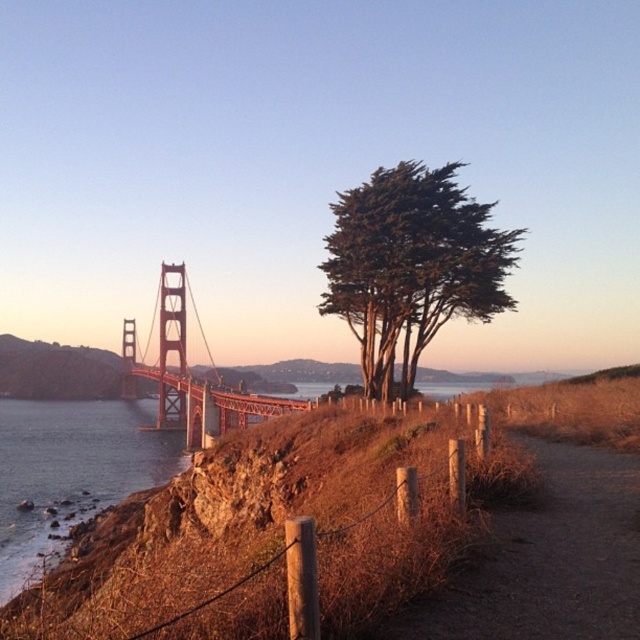
Question: Estimate the real-world distances between objects in this image. Which object is farther from the green textured tree at center?

Choices:
 (A) brown dirt path at center
 (B) red-orange metallic bridge at left

Answer: (A)

Question: Is green textured tree at center thinner than clear water at lower left?

Choices:
 (A) no
 (B) yes

Answer: (B)

Question: Which of the following is the closest to the observer?

Choices:
 (A) green textured tree at center
 (B) red-orange metallic bridge at left
 (C) clear water at lower left
 (D) brown dirt path at center

Answer: (D)

Question: Which object is positioned closest to the brown dirt path at center?

Choices:
 (A) clear water at lower left
 (B) green textured tree at center

Answer: (B)

Question: Can you confirm if brown dirt path at center is positioned to the right of clear water at lower left?

Choices:
 (A) yes
 (B) no

Answer: (A)

Question: Can you confirm if brown dirt path at center is bigger than clear water at lower left?

Choices:
 (A) yes
 (B) no

Answer: (B)